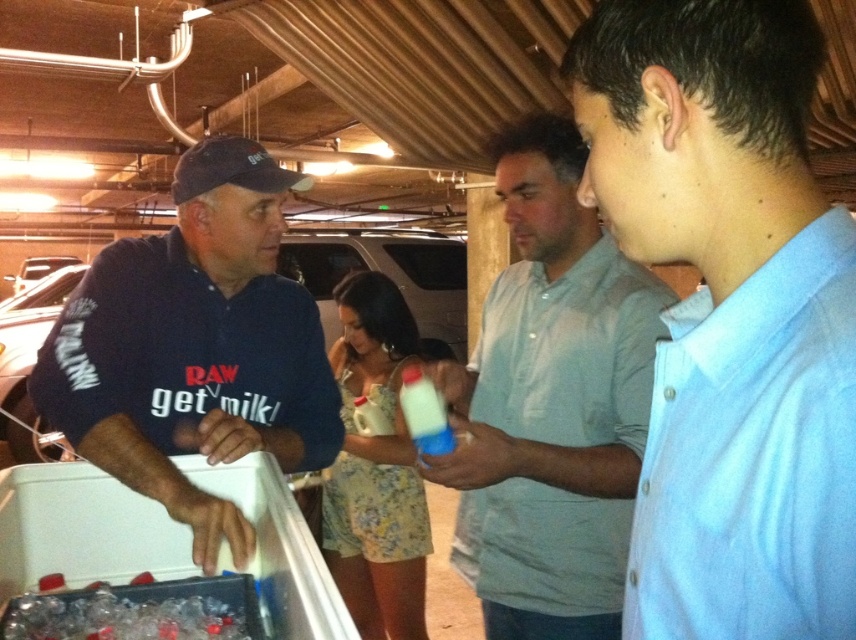
Question: Is dark blue polo shirt at left thinner than translucent plastic bottle at center?

Choices:
 (A) yes
 (B) no

Answer: (B)

Question: Which of these objects is positioned farthest from the dark blue polo shirt at left?

Choices:
 (A) light gray button-up shirt at center
 (B) translucent plastic bottle at center

Answer: (A)

Question: Does light blue button-down shirt at center appear under dark blue polo shirt at left?

Choices:
 (A) no
 (B) yes

Answer: (A)

Question: Where is light gray button-up shirt at center located in relation to dark blue polo shirt at left in the image?

Choices:
 (A) above
 (B) below

Answer: (B)

Question: Based on their relative distances, which object is farther from the light gray button-up shirt at center?

Choices:
 (A) light blue button-down shirt at center
 (B) dark blue polo shirt at left

Answer: (A)

Question: Which object appears farthest from the camera in this image?

Choices:
 (A) translucent plastic bottle at center
 (B) dark blue polo shirt at left

Answer: (A)